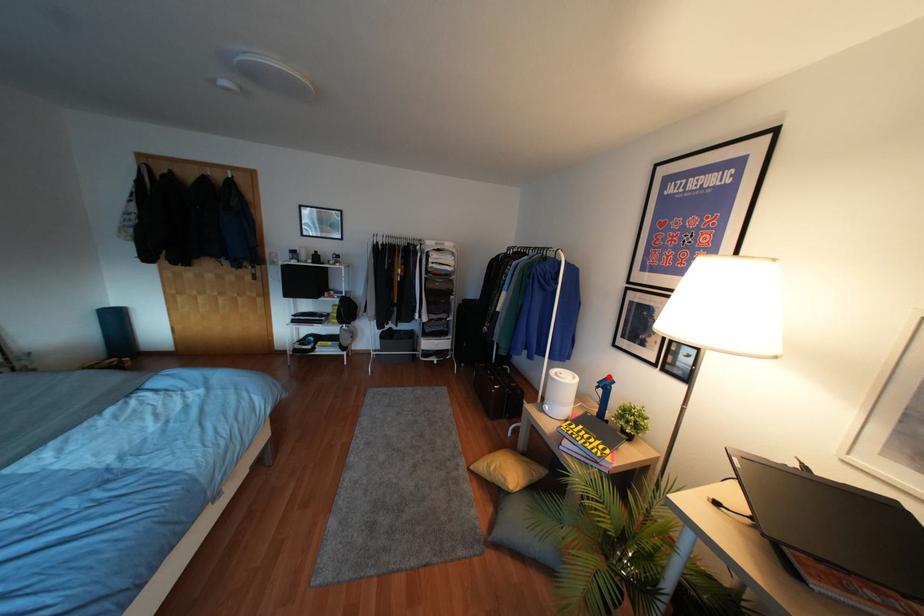
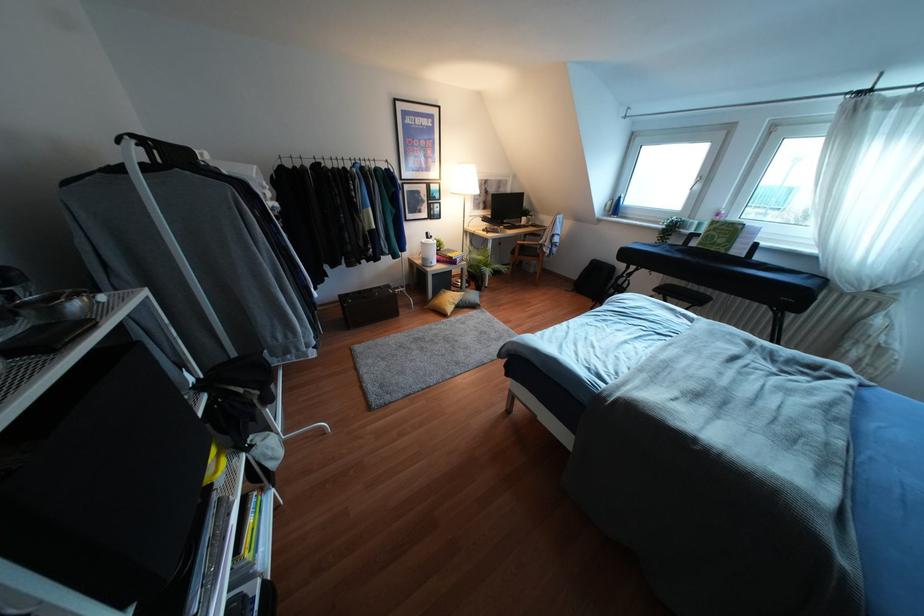
Where in the second image is the point corresponding to the highlighted location from the first image?

(427, 233)